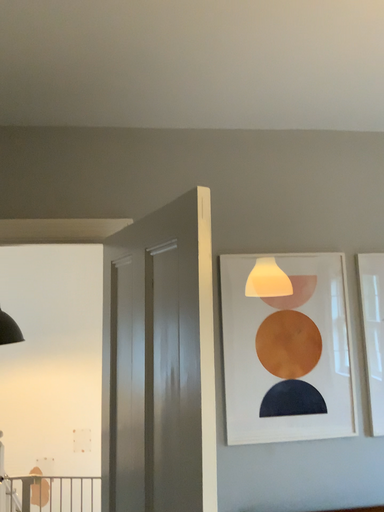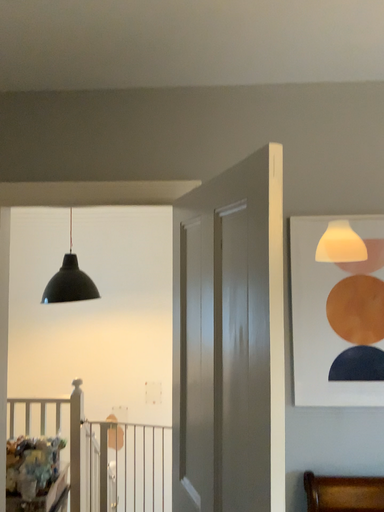
Question: Which way did the camera rotate in the video?

Choices:
 (A) rotated right
 (B) rotated left

Answer: (B)